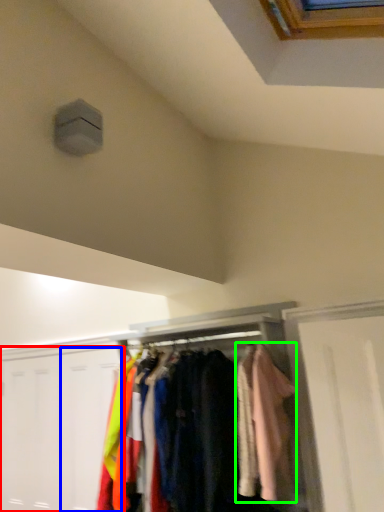
Question: Which object is positioned farthest from door (highlighted by a red box)? Select from door (highlighted by a blue box) and clothing (highlighted by a green box).

Choices:
 (A) door
 (B) clothing

Answer: (B)